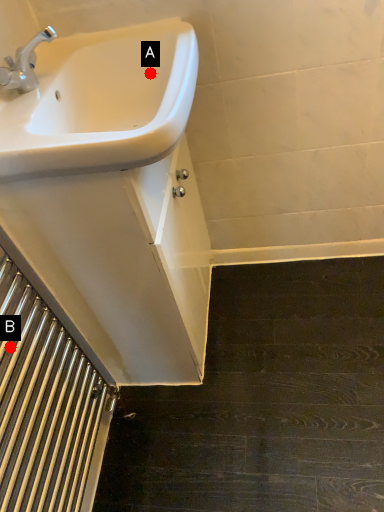
Question: Two points are circled on the image, labeled by A and B beside each circle. Which of the following is the closest to the observer?

Choices:
 (A) A is closer
 (B) B is closer

Answer: (B)